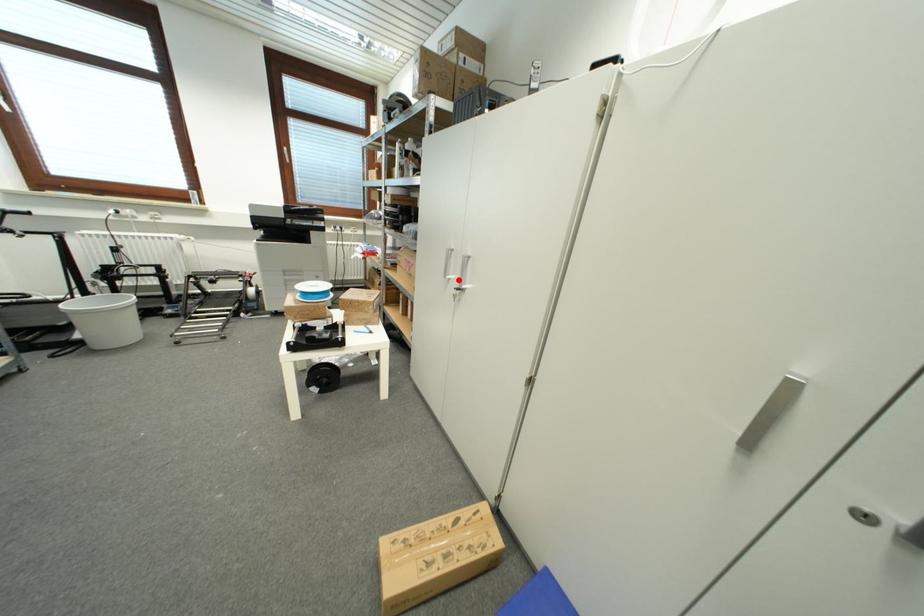
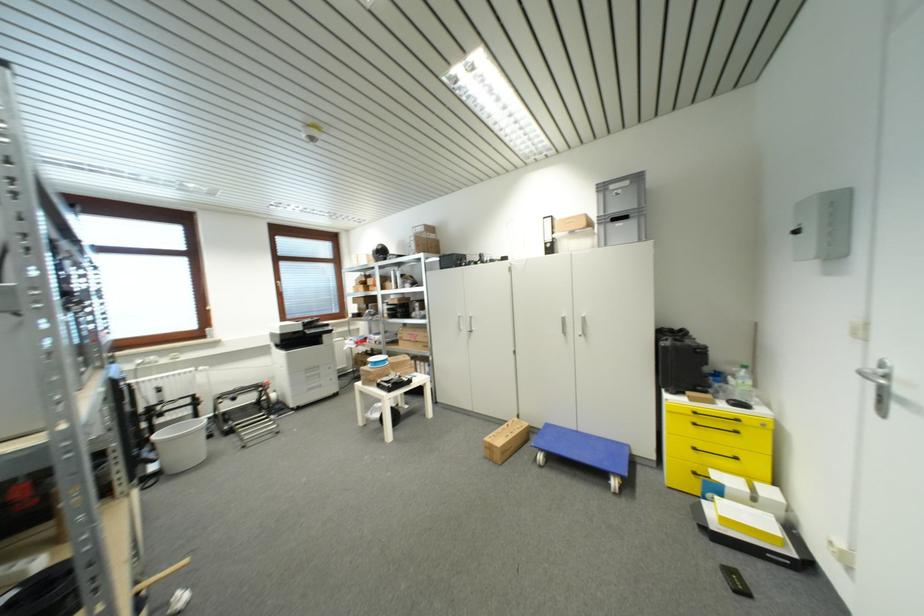
Locate, in the second image, the point that corresponds to the highlighted location in the first image.

(468, 330)